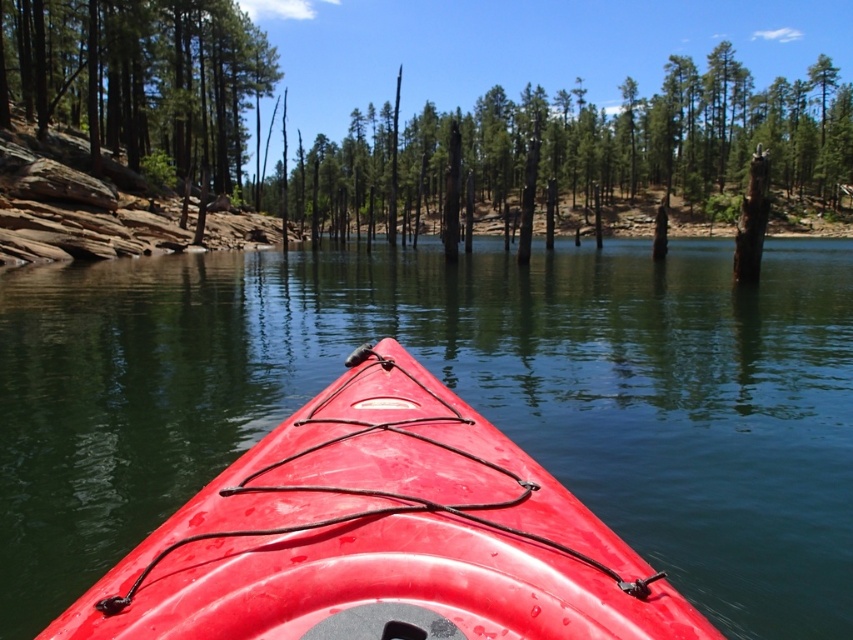
Based on the photo, is glossy plastic kayak at center smaller than smooth brown log at left?

Yes, glossy plastic kayak at center is smaller than smooth brown log at left.

Is glossy plastic kayak at center to the left of smooth brown log at left from the viewer's perspective?

Incorrect, glossy plastic kayak at center is not on the left side of smooth brown log at left.

Between point (526, 474) and point (219, 161), which one is positioned behind?

The point (219, 161) is more distant.

The width and height of the screenshot is (853, 640). I want to click on glossy plastic kayak at center, so click(381, 536).

Does dead wood stump at center have a greater width compared to smooth brown log at left?

Indeed, dead wood stump at center has a greater width compared to smooth brown log at left.

Between dead wood stump at center and smooth brown log at left, which one has less height?

smooth brown log at left

The height and width of the screenshot is (640, 853). Describe the element at coordinates (583, 145) in the screenshot. I see `dead wood stump at center` at that location.

Find the location of a particular element. dead wood stump at center is located at coordinates (583, 145).

Consider the image. Can you confirm if glossy plastic kayak at center is positioned to the right of dead wood stump at center?

Incorrect, glossy plastic kayak at center is not on the right side of dead wood stump at center.

Who is higher up, glossy plastic kayak at center or dead wood stump at center?

dead wood stump at center is above.

Is point (635, 554) closer to camera compared to point (395, 131)?

That is True.

This screenshot has width=853, height=640. Identify the location of glossy plastic kayak at center. 381,536.